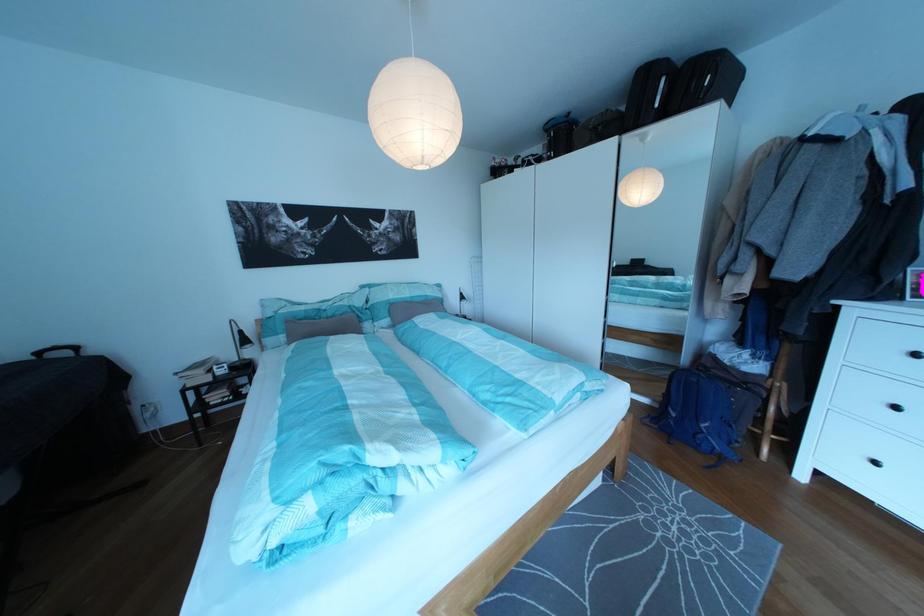
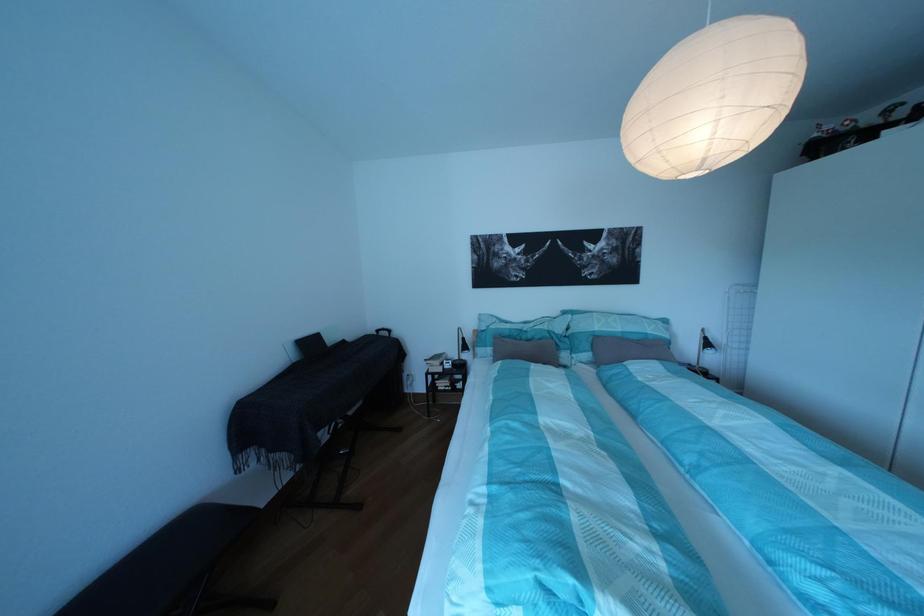
In the second image, find the point that corresponds to the point at 336,322 in the first image.

(538, 342)